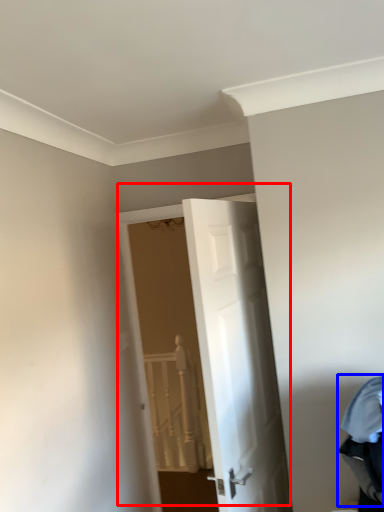
Question: Which of the following is the farthest to the observer, door (highlighted by a red box) or laundry (highlighted by a blue box)?

Choices:
 (A) door
 (B) laundry

Answer: (A)